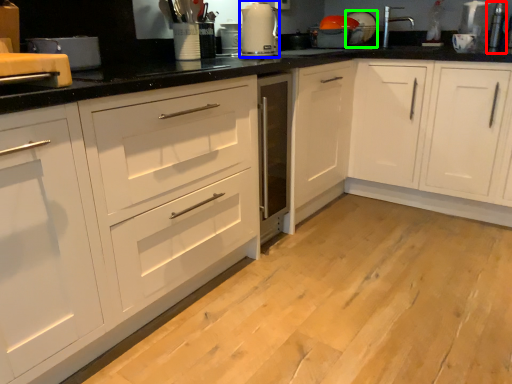
Question: Which object is the farthest from appliance (highlighted by a red box)? Choose among these: kitchen appliance (highlighted by a blue box) or appliance (highlighted by a green box).

Choices:
 (A) kitchen appliance
 (B) appliance

Answer: (A)